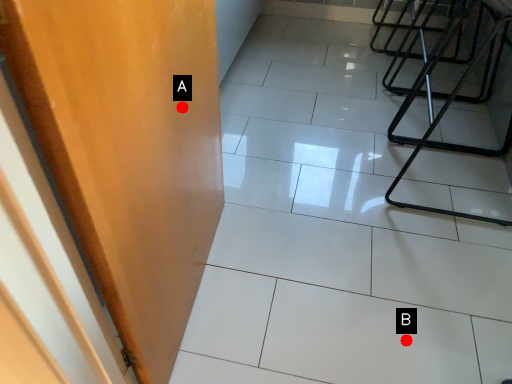
Question: Two points are circled on the image, labeled by A and B beside each circle. Which of the following is the closest to the observer?

Choices:
 (A) A is closer
 (B) B is closer

Answer: (A)